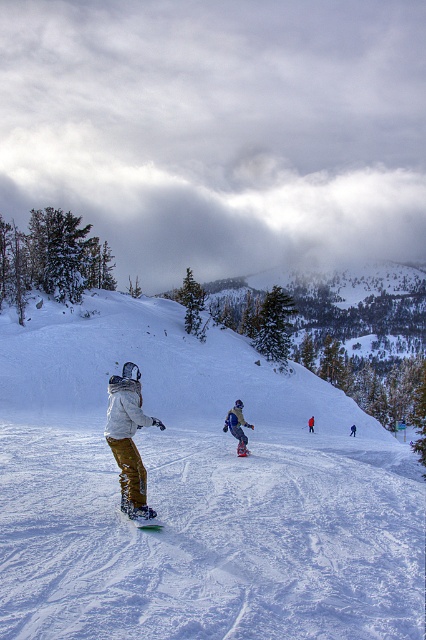
Question: Which point is closer to the camera?

Choices:
 (A) green plastic snowboard at center
 (B) matte yellow pants at center
 (C) blue snowboard at center

Answer: (A)

Question: Does matte yellow pants at center come behind blue snowboard at center?

Choices:
 (A) yes
 (B) no

Answer: (B)

Question: Does matte yellow pants at center appear on the left side of green plastic snowboard at center?

Choices:
 (A) no
 (B) yes

Answer: (B)

Question: Which point is closer to the camera?

Choices:
 (A) (161, 525)
 (B) (112, 397)
 (C) (238, 448)
 (D) (244, 448)

Answer: (A)

Question: Which point is farther to the camera?

Choices:
 (A) blue snowboard at center
 (B) matte black snowboard at center
 (C) green plastic snowboard at center
 (D) matte yellow pants at center

Answer: (B)

Question: Can you confirm if blue snowboard at center is positioned to the right of green plastic snowboard at center?

Choices:
 (A) yes
 (B) no

Answer: (A)